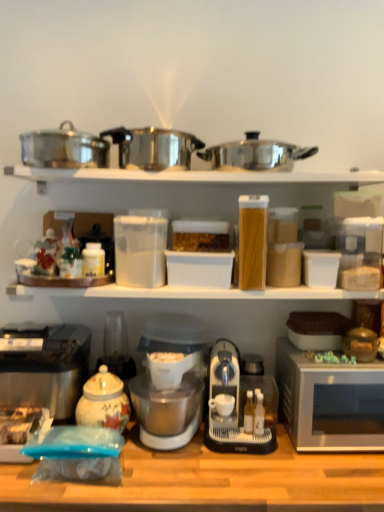
The width and height of the screenshot is (384, 512). Describe the element at coordinates (209, 481) in the screenshot. I see `wooden table at lower center` at that location.

The width and height of the screenshot is (384, 512). Identify the location of wooden table at lower center. (209, 481).

Identify the location of porcelain floral jar at center, which is counted as the first appliance, starting from the left. (117, 349).

Measure the distance between metallic pots at upper center and camera.

metallic pots at upper center and camera are 4.29 feet apart.

The width and height of the screenshot is (384, 512). What do you see at coordinates (360, 253) in the screenshot? I see `clear plastic container at upper center, the 2th appliance from the bottom` at bounding box center [360, 253].

What do you see at coordinates (255, 154) in the screenshot? This screenshot has width=384, height=512. I see `satin silver crock pot at upper center, marked as the 3th crock pot in a left-to-right arrangement` at bounding box center [255, 154].

At what (x,y) coordinates should I click in order to perform the action: click on satin silver crock pot at upper center, the 1th crock pot from the right. Please return your answer as a coordinate pair (x, y). The height and width of the screenshot is (512, 384). Looking at the image, I should click on pyautogui.click(x=255, y=154).

This screenshot has height=512, width=384. I want to click on wooden table at lower center, so click(x=209, y=481).

Looking at this image, in terms of width, does porcelain floral jar at center, which is counted as the first appliance, starting from the left, look wider or thinner when compared to shiny metallic crock pot at center, positioned as the second crock pot in left-to-right order?

Considering their sizes, porcelain floral jar at center, which is counted as the first appliance, starting from the left, looks slimmer than shiny metallic crock pot at center, positioned as the second crock pot in left-to-right order.

From the picture: From a real-world perspective, is porcelain floral jar at center, acting as the 1th appliance starting from the bottom, located beneath shiny metallic crock pot at center, positioned as the second crock pot in left-to-right order?

Yes, from a real-world perspective, porcelain floral jar at center, acting as the 1th appliance starting from the bottom, is beneath shiny metallic crock pot at center, positioned as the second crock pot in left-to-right order.

Does porcelain floral jar at center, acting as the 1th appliance starting from the bottom, contain shiny metallic crock pot at center, positioned as the second crock pot in left-to-right order?

No, porcelain floral jar at center, acting as the 1th appliance starting from the bottom, does not contain shiny metallic crock pot at center, positioned as the second crock pot in left-to-right order.

Is point (351, 262) closer to viewer compared to point (237, 152)?

No, (351, 262) is behind (237, 152).

Is clear plastic container at upper center, acting as the 2th appliance starting from the left, completely or partially outside of satin silver crock pot at upper center, the 1th crock pot from the right?

Yes, clear plastic container at upper center, acting as the 2th appliance starting from the left, is outside of satin silver crock pot at upper center, the 1th crock pot from the right.

Image resolution: width=384 pixels, height=512 pixels. In order to click on the 2nd crock pot above the clear plastic container at upper center, acting as the 2th appliance starting from the left (from a real-world perspective) in this screenshot , I will do `click(255, 154)`.

From a real-world perspective, is clear plastic container at upper center, which appears as the first appliance when viewed from the right, positioned over satin silver crock pot at upper center, marked as the 3th crock pot in a left-to-right arrangement, based on gravity?

No.

Is sleek metallic coffee machine at center facing towards satin silver crock pot at upper center, the 1th crock pot from the right?

No, sleek metallic coffee machine at center is not oriented towards satin silver crock pot at upper center, the 1th crock pot from the right.

Which is more to the right, sleek metallic coffee machine at center or satin silver crock pot at upper center, marked as the 3th crock pot in a left-to-right arrangement?

From the viewer's perspective, satin silver crock pot at upper center, marked as the 3th crock pot in a left-to-right arrangement, appears more on the right side.

Considering the relative sizes of sleek metallic coffee machine at center and satin silver crock pot at upper center, the 1th crock pot from the right, in the image provided, is sleek metallic coffee machine at center thinner than satin silver crock pot at upper center, the 1th crock pot from the right,?

Incorrect, the width of sleek metallic coffee machine at center is not less than that of satin silver crock pot at upper center, the 1th crock pot from the right.

Considering the relative sizes of silver metallic microwave at right and porcelain floral jar at center, acting as the 1th appliance starting from the bottom, in the image provided, is silver metallic microwave at right smaller than porcelain floral jar at center, acting as the 1th appliance starting from the bottom,?

Incorrect, silver metallic microwave at right is not smaller in size than porcelain floral jar at center, acting as the 1th appliance starting from the bottom.

Considering the points (322, 443) and (110, 355), which point is in front, point (322, 443) or point (110, 355)?

The point (322, 443) is in front.

Based on the photo, is silver metallic microwave at right oriented away from porcelain floral jar at center, acting as the 1th appliance starting from the bottom?

No, porcelain floral jar at center, acting as the 1th appliance starting from the bottom, is not at the back of silver metallic microwave at right.

From a real-world perspective, is silver metallic microwave at right physically below porcelain floral jar at center, the 2th appliance when ordered from top to bottom?

Yes, from a real-world perspective, silver metallic microwave at right is below porcelain floral jar at center, the 2th appliance when ordered from top to bottom.

Which of these two, metallic pots at upper center or translucent plastic container at center, stands shorter?

metallic pots at upper center is shorter.

From a real-world perspective, between metallic pots at upper center and translucent plastic container at center, who is vertically higher?

From a 3D spatial view, metallic pots at upper center is above.

Is metallic pots at upper center next to translucent plastic container at center?

No.

Considering the sizes of objects porcelain floral tea pot at lower left and porcelain floral jar at center, acting as the 1th appliance starting from the bottom, in the image provided, who is shorter, porcelain floral tea pot at lower left or porcelain floral jar at center, acting as the 1th appliance starting from the bottom,?

With less height is porcelain floral tea pot at lower left.

Is point (129, 415) more distant than point (120, 338)?

No, (129, 415) is closer to viewer.

Is porcelain floral tea pot at lower left not close to porcelain floral jar at center, acting as the 1th appliance starting from the bottom?

porcelain floral tea pot at lower left is near porcelain floral jar at center, acting as the 1th appliance starting from the bottom, not far away.

Is porcelain floral tea pot at lower left spatially inside porcelain floral jar at center, the 2th appliance when ordered from top to bottom, or outside of it?

porcelain floral tea pot at lower left is located beyond the bounds of porcelain floral jar at center, the 2th appliance when ordered from top to bottom.

From a real-world perspective, which object stands above the other?

In real-world perspective, stainless steel crock pot at upper left, the first crock pot when ordered from left to right, is above.

From the image's perspective, is wooden table at lower center above stainless steel crock pot at upper left, the third crock pot from the right?

No.

Is wooden table at lower center aimed at stainless steel crock pot at upper left, the third crock pot from the right?

No, wooden table at lower center is not facing towards stainless steel crock pot at upper left, the third crock pot from the right.

Which is less distant, (x=307, y=474) or (x=38, y=150)?

Point (x=307, y=474).

The width and height of the screenshot is (384, 512). I want to click on appliance on the left of shiny metallic crock pot at center, which appears as the 2th crock pot when viewed from the right, so click(117, 349).

Which crock pot is the 1st one when counting from the front of the clear plastic container at upper center, acting as the 2th appliance starting from the left? Please provide its 2D coordinates.

[(255, 154)]

Which object lies nearer to the anchor point clear plastic container at upper center, acting as the 2th appliance starting from the left, metallic pots at upper center or shiny metallic crock pot at center, which appears as the 2th crock pot when viewed from the right?

metallic pots at upper center lies closer to clear plastic container at upper center, acting as the 2th appliance starting from the left, than the other object.

Looking at the image, which one is located further to clear plastic container at upper center, acting as the 2th appliance starting from the left, silver metallic microwave at right or wooden table at lower center?

wooden table at lower center.

Considering their positions, is sleek metallic coffee machine at center positioned further to metallic pots at upper center than silver metallic microwave at right?

sleek metallic coffee machine at center is further to metallic pots at upper center.

Based on their spatial positions, is metallic silver toaster at lower left or porcelain floral jar at center, the 2th appliance when ordered from top to bottom, further from clear plastic container at upper center, acting as the 2th appliance starting from the left?

metallic silver toaster at lower left lies further to clear plastic container at upper center, acting as the 2th appliance starting from the left, than the other object.

In the scene shown: Considering their positions, is satin silver crock pot at upper center, marked as the 3th crock pot in a left-to-right arrangement, positioned closer to translucent plastic container at center than silver metallic microwave at right?

satin silver crock pot at upper center, marked as the 3th crock pot in a left-to-right arrangement, is closer to translucent plastic container at center.

Looking at the image, which one is located further to porcelain floral jar at center, which is counted as the first appliance, starting from the left, metallic silver toaster at lower left or porcelain floral tea pot at lower left?

The object further to porcelain floral jar at center, which is counted as the first appliance, starting from the left, is metallic silver toaster at lower left.

Looking at the image, which one is located further to metallic silver toaster at lower left, stainless steel crock pot at upper left, the third crock pot from the right, or silver metallic microwave at right?

silver metallic microwave at right is further to metallic silver toaster at lower left.

Based on their spatial positions, is metallic pots at upper center or stainless steel crock pot at upper left, the third crock pot from the right, further from sleek metallic coffee machine at center?

stainless steel crock pot at upper left, the third crock pot from the right, lies further to sleek metallic coffee machine at center than the other object.

The image size is (384, 512). What are the coordinates of `microwave oven between shiny metallic crock pot at center, positioned as the second crock pot in left-to-right order, and wooden table at lower center in the up-down direction` in the screenshot? It's located at (330, 402).

Find the location of a particular element. The width and height of the screenshot is (384, 512). microwave oven between translucent plastic container at center and wooden table at lower center from top to bottom is located at coordinates (330, 402).

The image size is (384, 512). What are the coordinates of `kitchen appliance between white plastic coffee maker at center and wooden table at lower center in the up-down direction` in the screenshot? It's located at (238, 405).

Where is `shelf situated between stainless steel crock pot at upper left, the first crock pot when ordered from left to right, and clear plastic container at upper center, which appears as the first appliance when viewed from the right, from left to right`? Image resolution: width=384 pixels, height=512 pixels. shelf situated between stainless steel crock pot at upper left, the first crock pot when ordered from left to right, and clear plastic container at upper center, which appears as the first appliance when viewed from the right, from left to right is located at coordinates (196, 176).